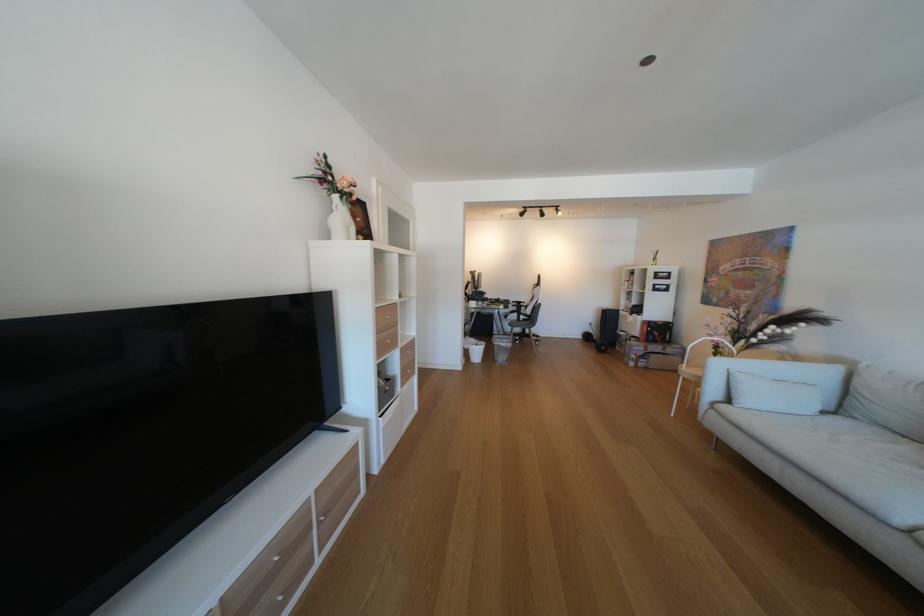
What do you see at coordinates (386, 339) in the screenshot?
I see `a wooden drawer handle` at bounding box center [386, 339].